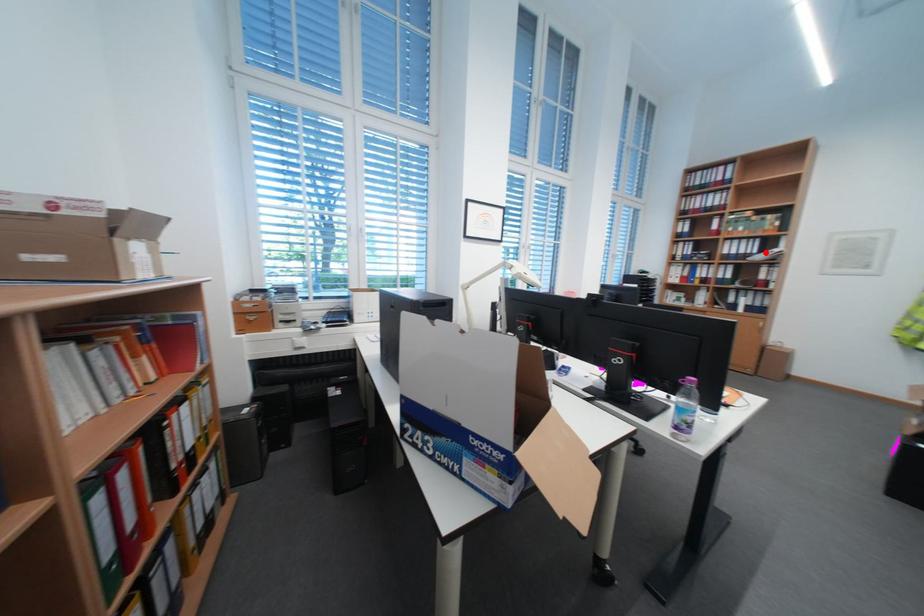
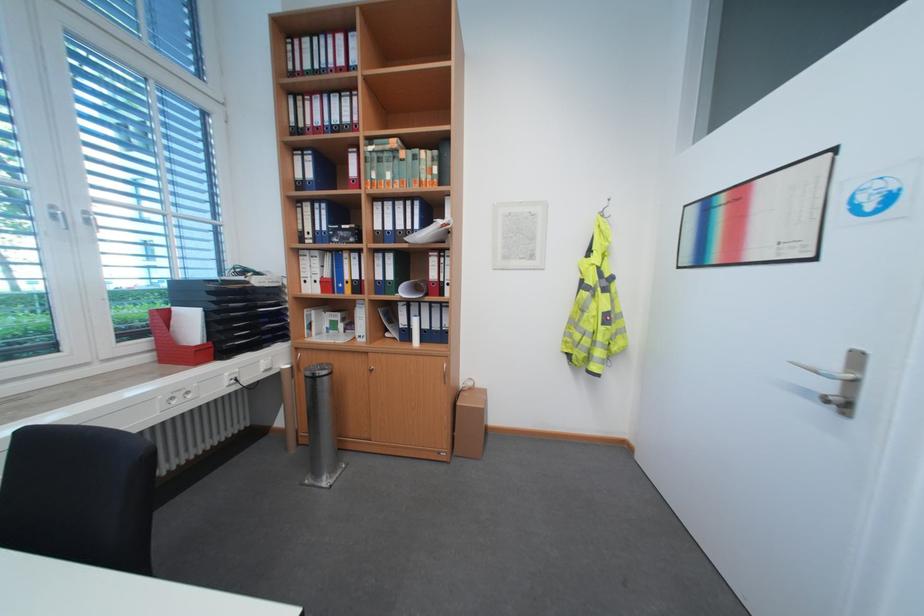
Question: I am providing you with two images of the same scene from different viewpoints. Image1 has a red point marked. In image2, the corresponding 3D location appears at what relative position? Reply with the corresponding letter.

Choices:
 (A) Closer
 (B) Farther

Answer: (A)